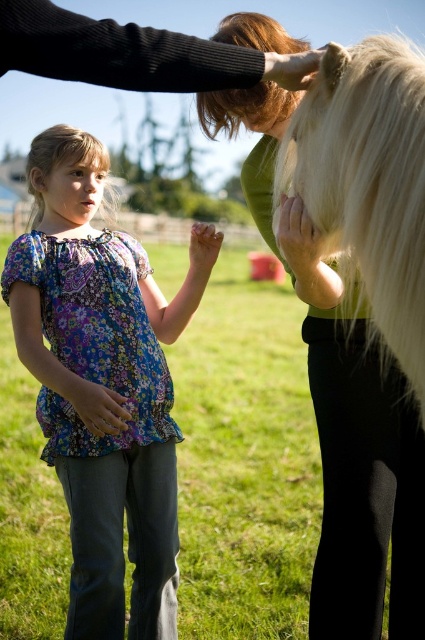
Question: Is matte white hand at center to the left of smooth skin hand at upper center from the viewer's perspective?

Choices:
 (A) yes
 (B) no

Answer: (B)

Question: Based on their relative distances, which object is nearer to the matte floral blouse at center?

Choices:
 (A) matte white hand at center
 (B) pink matte nose at upper center

Answer: (B)

Question: Among these objects, which one is nearest to the camera?

Choices:
 (A) blonde silky hair at center
 (B) white silky horse at upper right

Answer: (B)

Question: Which of these objects is positioned farthest from the matte white hand at center?

Choices:
 (A) blonde silky hair at upper center
 (B) floral fabric blouse at center
 (C) matte skin hand at center
 (D) smooth green shirt at upper center

Answer: (B)

Question: Observing the image, what is the correct spatial positioning of floral fabric blouse at center in reference to smooth skin hand at upper center?

Choices:
 (A) above
 (B) below

Answer: (B)

Question: Can you confirm if blonde silky hair at upper center is thinner than smooth skin hand at upper center?

Choices:
 (A) yes
 (B) no

Answer: (B)